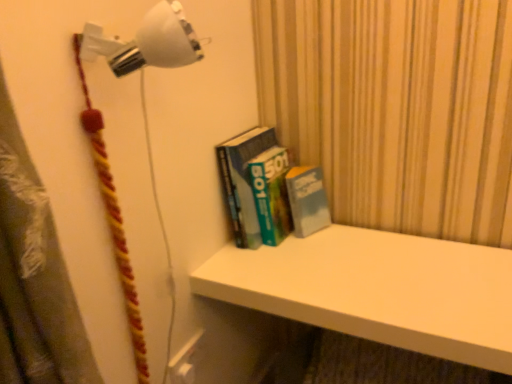
Locate an element on the screen. unoccupied region to the right of hardcover books at center is located at coordinates (362, 249).